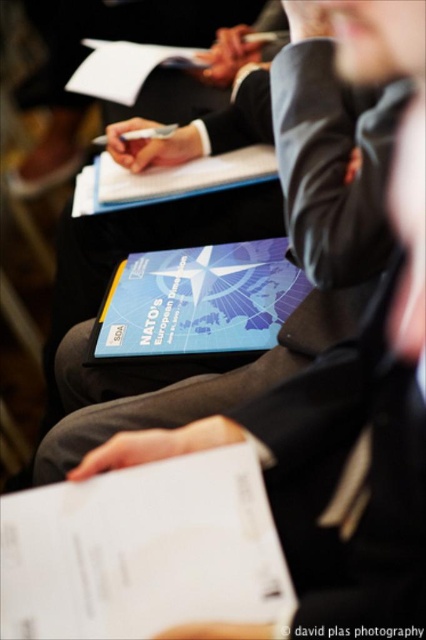
How distant is dark gray wool business suit at center from blue matte book at center?

They are 5.96 inches apart.

Between dark gray wool business suit at center and blue matte book at center, which one appears on the right side from the viewer's perspective?

From the viewer's perspective, blue matte book at center appears more on the right side.

Between point (83, 422) and point (249, 262), which one is positioned behind?

Point (249, 262)

Identify the location of dark gray wool business suit at center. (290, 252).

Between dark gray wool business suit at center and matte black pen at upper center, which one is positioned lower?

matte black pen at upper center is below.

Consider the image. Between dark gray wool business suit at center and matte black pen at upper center, which one has more height?

dark gray wool business suit at center is taller.

The image size is (426, 640). What are the coordinates of `dark gray wool business suit at center` in the screenshot? It's located at (290, 252).

I want to click on dark gray wool business suit at center, so click(290, 252).

Which is more to the left, blue matte book at center or matte black pen at upper center?

From the viewer's perspective, blue matte book at center appears more on the left side.

Consider the image. Does blue matte book at center appear on the left side of matte black pen at upper center?

Indeed, blue matte book at center is positioned on the left side of matte black pen at upper center.

Is point (144, 289) positioned before point (354, 625)?

That is False.

Find the location of a particular element. The image size is (426, 640). blue matte book at center is located at coordinates (196, 301).